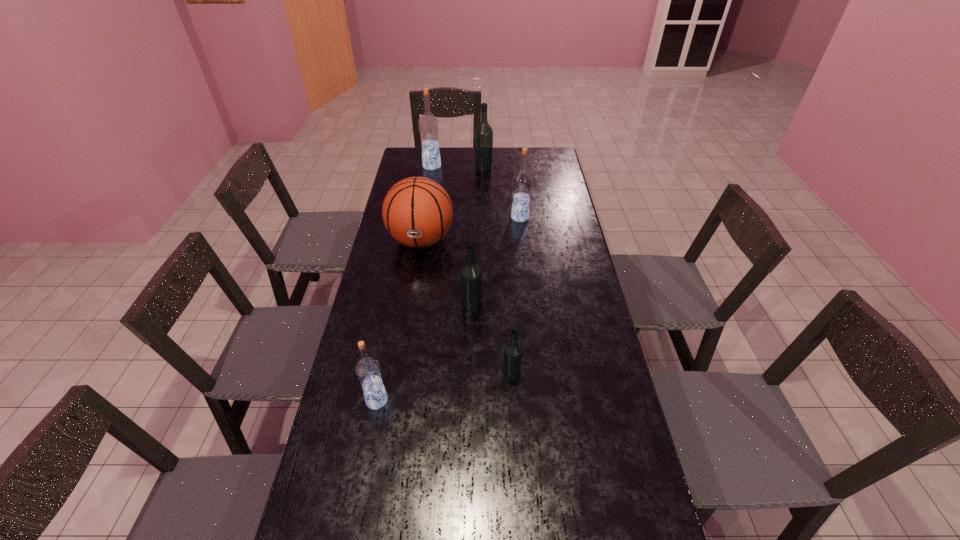
This screenshot has width=960, height=540. I want to click on the tallest object, so click(428, 124).

Where is `the biggest blue vodka`? The width and height of the screenshot is (960, 540). the biggest blue vodka is located at coordinates (428, 124).

This screenshot has height=540, width=960. I want to click on the farthest black vodka, so click(483, 134).

Identify the location of the rightmost vodka. (522, 180).

Identify the location of the rightmost object. This screenshot has height=540, width=960. (522, 180).

The height and width of the screenshot is (540, 960). Find the location of `basketball`. basketball is located at coordinates (417, 212).

The image size is (960, 540). What are the coordinates of `the fifth farthest object` in the screenshot? It's located at (471, 277).

Locate an element on the screen. The image size is (960, 540). the second biggest black vodka is located at coordinates (471, 277).

This screenshot has width=960, height=540. What are the coordinates of `the nearest blue vodka` in the screenshot? It's located at (368, 370).

Identify the location of the nearest vodka. The height and width of the screenshot is (540, 960). (368, 370).